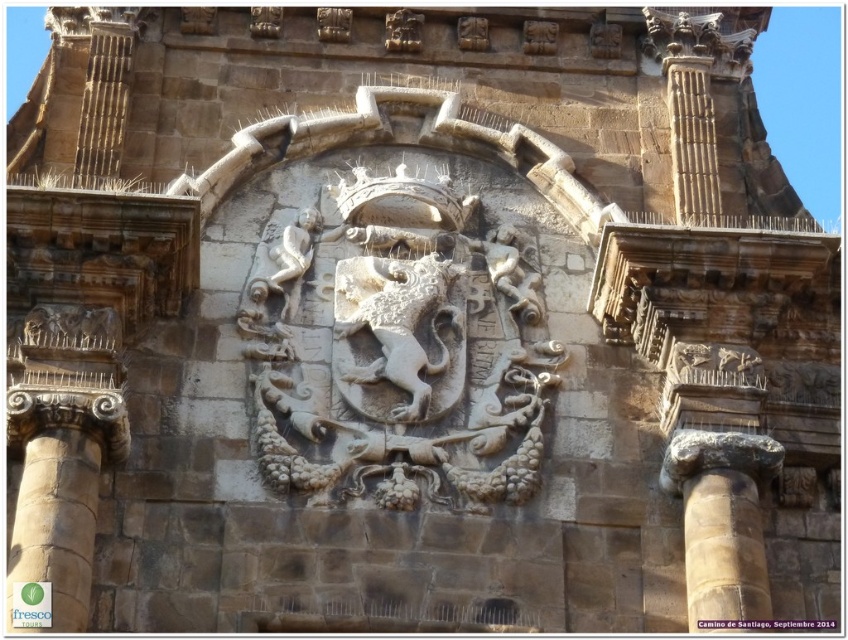
Question: Among these objects, which one is farthest from the camera?

Choices:
 (A) brown stone column at right
 (B) white stone crest at center

Answer: (B)

Question: Can you confirm if white stone crest at center is positioned below brown stone column at right?

Choices:
 (A) no
 (B) yes

Answer: (A)

Question: Can you confirm if white stone crest at center is positioned below brown stone column at right?

Choices:
 (A) no
 (B) yes

Answer: (A)

Question: Which object is farther from the camera taking this photo?

Choices:
 (A) white stone crest at center
 (B) brown stone column at right

Answer: (A)

Question: Considering the relative positions of white stone crest at center and brown stone column at right in the image provided, where is white stone crest at center located with respect to brown stone column at right?

Choices:
 (A) below
 (B) above

Answer: (B)